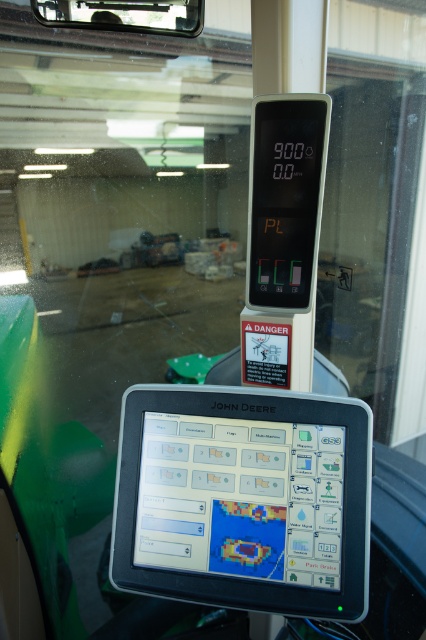
Does black plastic tablet computer at center appear under black plastic display at upper center?

Yes.

Find the location of `black plastic tablet computer at center`. black plastic tablet computer at center is located at coordinates pyautogui.click(x=244, y=499).